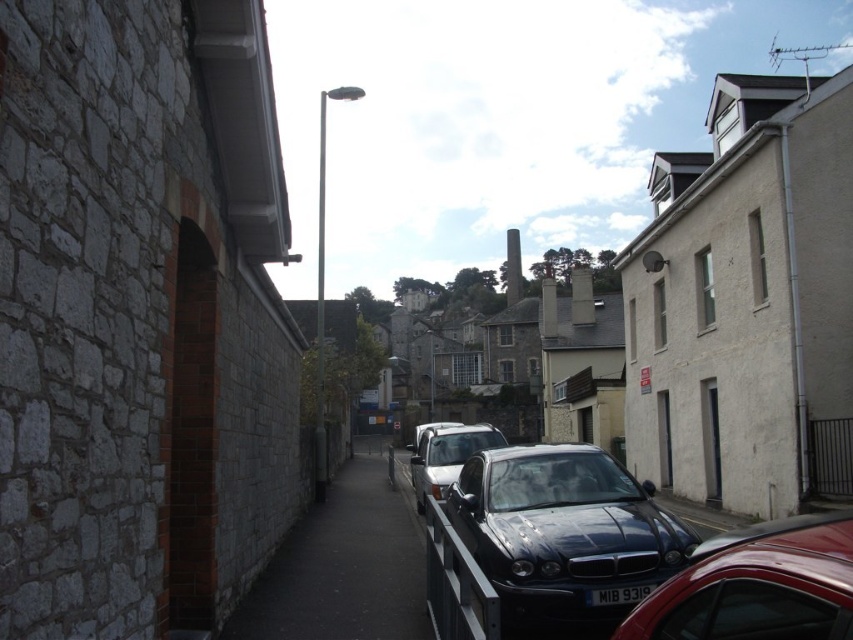
You are a delivery person trying to park your metallic silver car at center in the narrow urban street. The black asphalt sidewalk at center is where pedestrians walk. Is there enough space to park your car without blocking the sidewalk?

The black asphalt sidewalk at center has a smaller size compared to metallic silver car at center. Therefore, parking the metallic silver car at center might block the sidewalk since the sidewalk is narrower than the car.

You are standing at the point labeled point (343, 566) in this urban street scene. What type of surface are you currently standing on?

You are standing on the black asphalt sidewalk at center, as the coordinates point (343, 566) corresponds to that surface.

You are a delivery person trying to park your metallic silver car at center in this narrow urban street. The parking spot you want is located at coordinates point 0.6, 0.5. Can your car reach the parking spot without moving any other vehicles?

The metallic silver car at center is positioned at point (445,456), which is close to the desired parking spot at (426,384). However, since the street is narrow and other parked cars are present along both sides, it may not be possible to maneuver the car into the spot without displacing other vehicles.